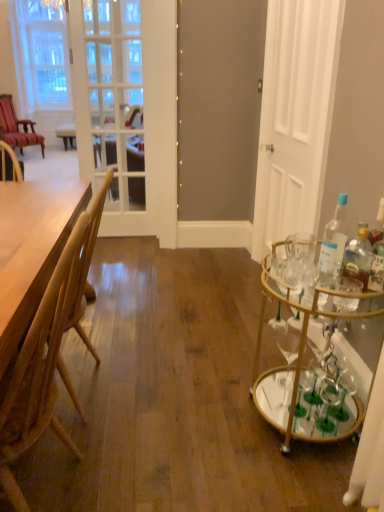
Question: Can you confirm if gold mirrored bar cart at right is taller than wooden table at left?

Choices:
 (A) no
 (B) yes

Answer: (A)

Question: Does gold mirrored bar cart at right have a lesser width compared to wooden table at left?

Choices:
 (A) no
 (B) yes

Answer: (B)

Question: Can you confirm if gold mirrored bar cart at right is positioned to the left of wooden table at left?

Choices:
 (A) yes
 (B) no

Answer: (B)

Question: Is gold mirrored bar cart at right oriented towards wooden table at left?

Choices:
 (A) no
 (B) yes

Answer: (B)

Question: Considering the relative sizes of gold mirrored bar cart at right and wooden table at left in the image provided, is gold mirrored bar cart at right bigger than wooden table at left?

Choices:
 (A) yes
 (B) no

Answer: (B)

Question: Considering the positions of clear glass bottle at right, acting as the second bottle starting from the left, and white matte door at right in the image, is clear glass bottle at right, acting as the second bottle starting from the left, bigger or smaller than white matte door at right?

Choices:
 (A) small
 (B) big

Answer: (A)

Question: Is clear glass bottle at right, positioned as the first bottle in right-to-left order, wider or thinner than white matte door at right?

Choices:
 (A) wide
 (B) thin

Answer: (B)

Question: Is clear glass bottle at right, positioned as the first bottle in right-to-left order, in front of or behind white matte door at right in the image?

Choices:
 (A) front
 (B) behind

Answer: (A)

Question: Is clear glass bottle at right, acting as the second bottle starting from the left, inside or outside of white matte door at right?

Choices:
 (A) outside
 (B) inside

Answer: (A)

Question: From a real-world perspective, is gold mirrored bar cart at right above or below clear glass bottle at right, acting as the second bottle starting from the left?

Choices:
 (A) below
 (B) above

Answer: (A)

Question: From the image's perspective, is gold mirrored bar cart at right above or below clear glass bottle at right, acting as the second bottle starting from the left?

Choices:
 (A) below
 (B) above

Answer: (A)

Question: In the image, is gold mirrored bar cart at right positioned in front of or behind clear glass bottle at right, acting as the second bottle starting from the left?

Choices:
 (A) front
 (B) behind

Answer: (A)

Question: Looking at the image, does gold mirrored bar cart at right seem bigger or smaller compared to clear glass bottle at right, acting as the second bottle starting from the left?

Choices:
 (A) big
 (B) small

Answer: (A)

Question: Relative to clear glass bottle at right, acting as the second bottle starting from the left, is light brown wood chair at left, which appears as the second chair when viewed from the top, in front or behind?

Choices:
 (A) front
 (B) behind

Answer: (A)

Question: From a real-world perspective, is light brown wood chair at left, marked as the 2th chair in a left-to-right arrangement, physically located above or below clear glass bottle at right, acting as the second bottle starting from the left?

Choices:
 (A) above
 (B) below

Answer: (B)